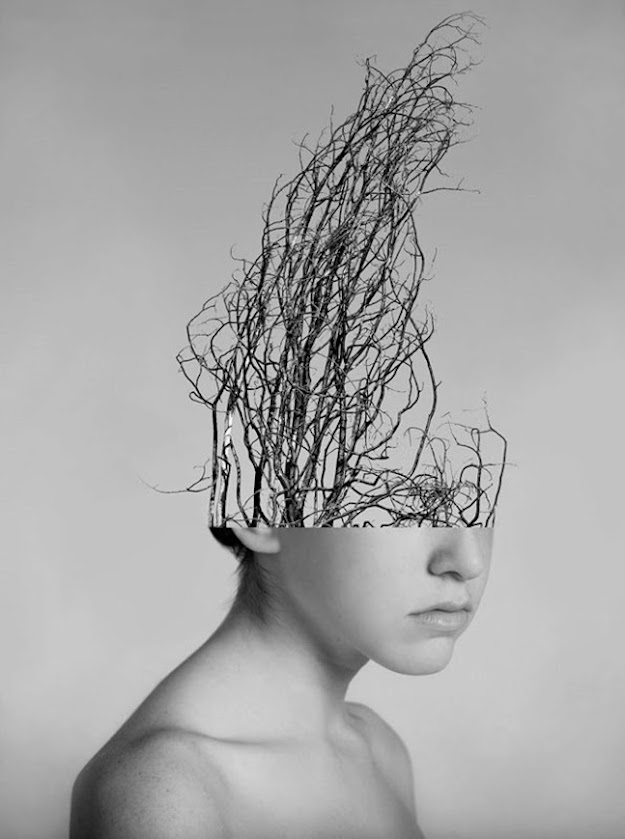
This screenshot has width=625, height=839. In order to click on chest in this screenshot , I will do `click(345, 789)`.